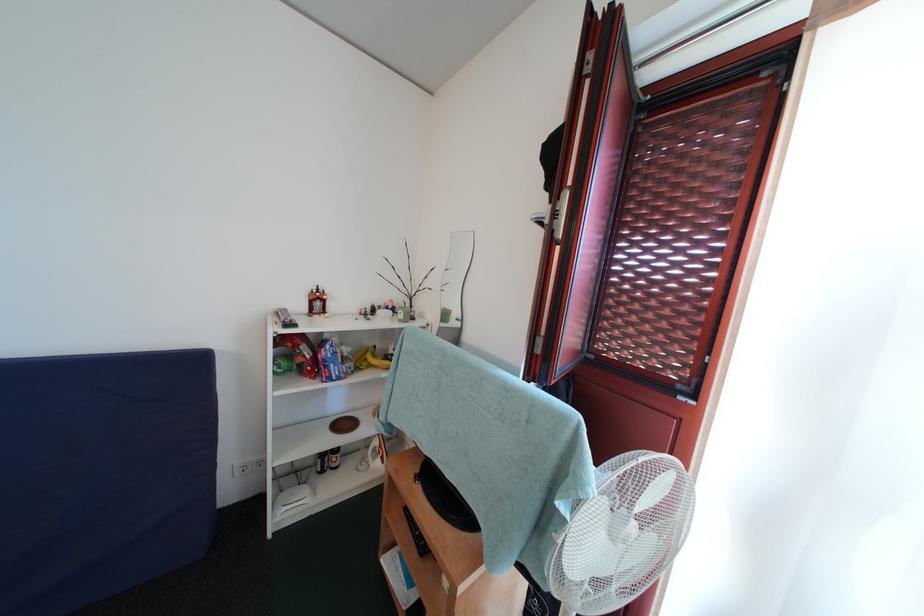
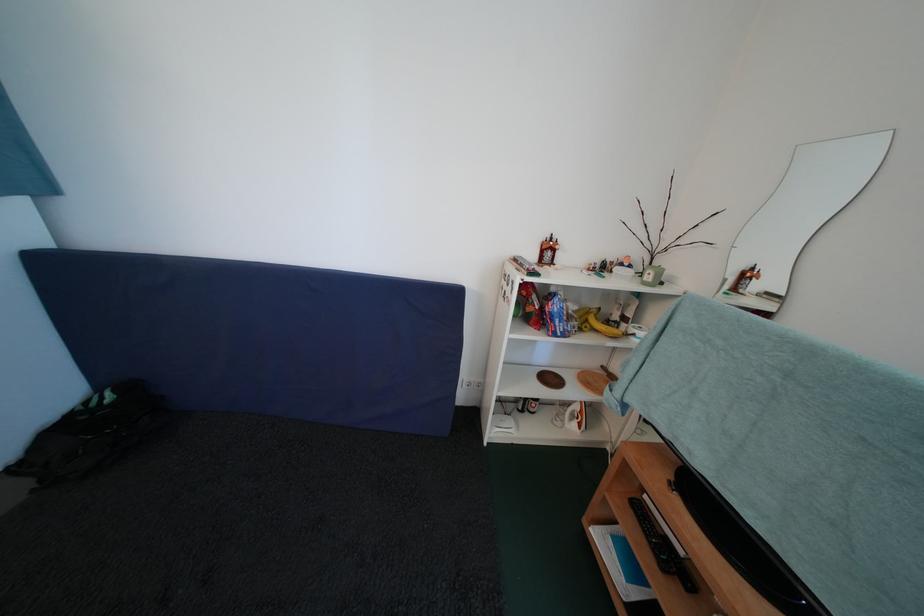
Find the pixel in the second image that matches the point at 365,461 in the first image.

(561, 416)